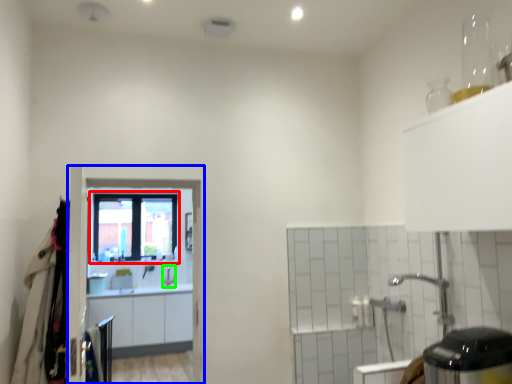
Question: Which object is positioned farthest from window (highlighted by a red box)? Select from screen door (highlighted by a blue box) and faucet (highlighted by a green box).

Choices:
 (A) screen door
 (B) faucet

Answer: (A)